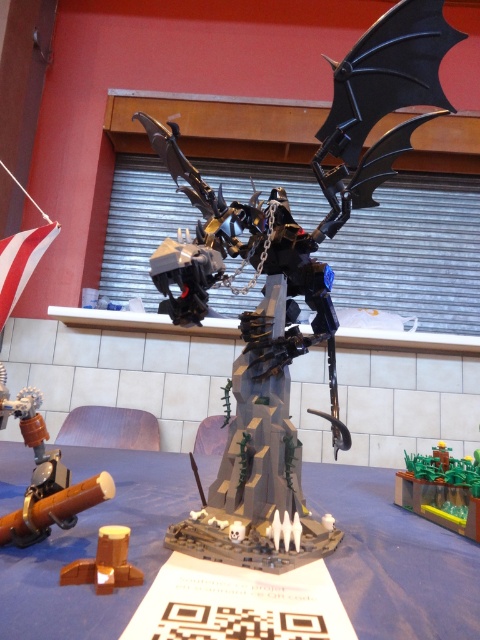
You are a LEGO enthusiast examining the sculpture. You notice the black matte dragon at center and the brushed metal pipe at lower left. Which object is located to the right of the other?

The black matte dragon at center is positioned on the right side of the brushed metal pipe at lower left.

You are a delivery robot with a height of 14 inches. You need to deliver a package to the blue fabric table at center. The black matte dragon at center is in your path. Can you pass under the dragon without hitting your head?

The distance between the black matte dragon at center and the blue fabric table at center is 14.70 inches. Since the robot is 14 inches tall, it can safely pass under the dragon as the clearance is sufficient.

You are a photographer setting up a tripod to capture the black matte dragon at center and the brushed metal pipe at lower left. Since you want to ensure both subjects are in focus, you need to know which one is taller. Can you determine which object is taller?

The black matte dragon at center is taller than the brushed metal pipe at lower left, so you should adjust your camera settings to focus on the taller dragon first.